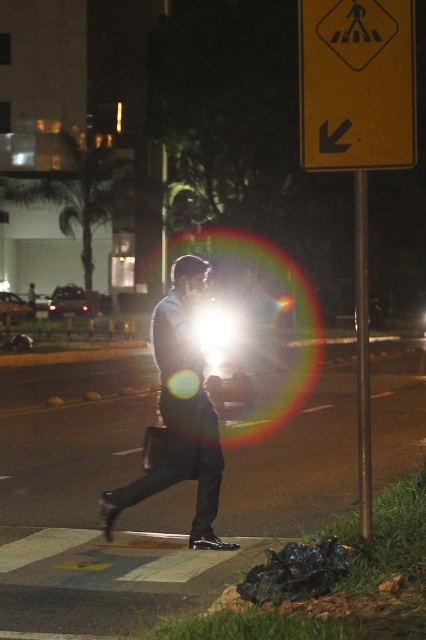
You are a pedestrian trying to navigate the street at night. You notice a yellow plastic traffic sign at upper right and a light blue shirt at center. Which object is nearer to you?

The yellow plastic traffic sign at upper right is closer to the viewer than the light blue shirt at center.

Looking at this image, you are a pedestrian standing at the point labeled point (379, 28) and want to walk to the point labeled point (356, 205). Given that both points are on the same street, which direction should you face to move towards your destination?

Since point (379, 28) is closer to the viewer than point (356, 205), you should face away from the viewer to move towards your destination.